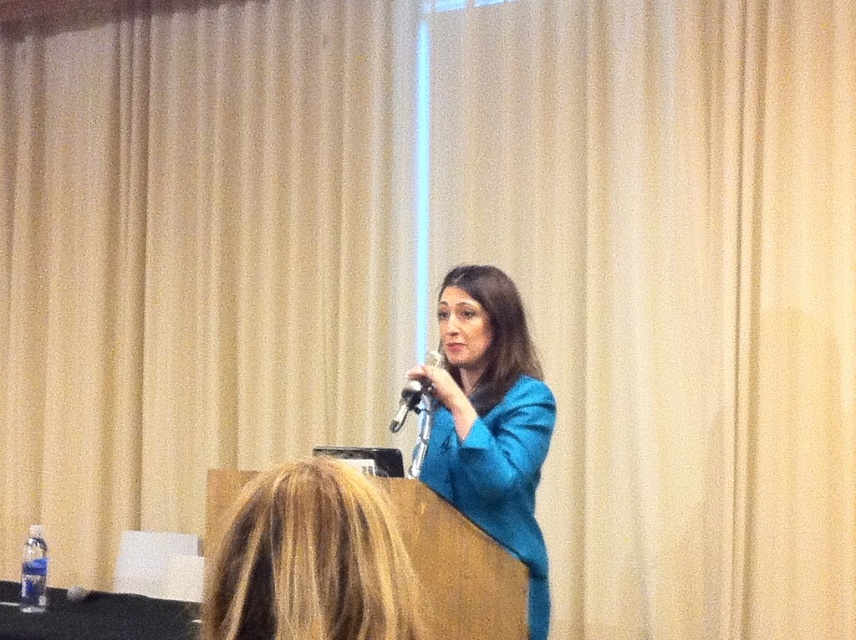
Question: In this image, where is beige textured curtain at upper center located relative to blue fabric at center?

Choices:
 (A) above
 (B) below

Answer: (A)

Question: Which point is closer to the camera?

Choices:
 (A) blue fabric at center
 (B) metallic silver microphone at center
 (C) blonde hair at upper center
 (D) beige textured curtain at upper center

Answer: (C)

Question: Does blonde hair at upper center have a smaller size compared to metallic silver microphone at center?

Choices:
 (A) yes
 (B) no

Answer: (B)

Question: Can you confirm if beige textured curtain at upper center is bigger than metallic silver microphone at center?

Choices:
 (A) yes
 (B) no

Answer: (A)

Question: Which point appears closest to the camera in this image?

Choices:
 (A) (337, 348)
 (B) (509, 509)
 (C) (402, 413)

Answer: (C)

Question: Which is farther from the metallic silver microphone at center?

Choices:
 (A) blue fabric at center
 (B) beige textured curtain at upper center

Answer: (B)